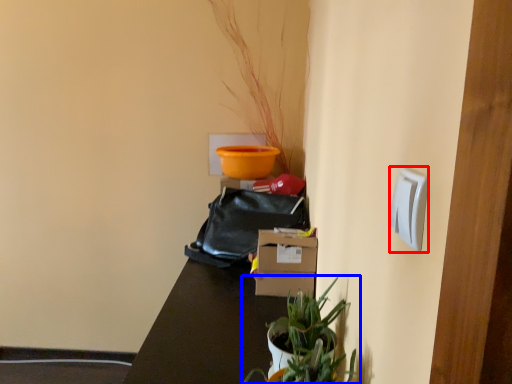
Question: Which object is further to the camera taking this photo, light switch (highlighted by a red box) or houseplant (highlighted by a blue box)?

Choices:
 (A) light switch
 (B) houseplant

Answer: (B)